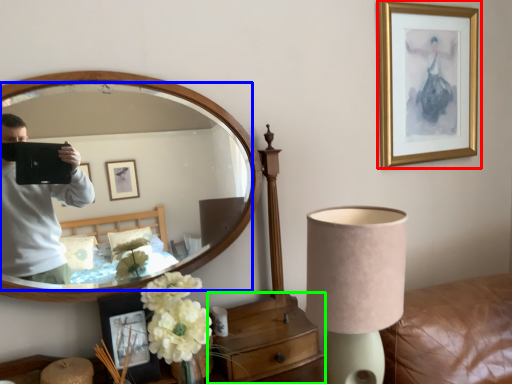
Question: Which object is the closest to the picture frame (highlighted by a red box)? Choose among these: mirror (highlighted by a blue box) or dresser (highlighted by a green box).

Choices:
 (A) mirror
 (B) dresser

Answer: (A)